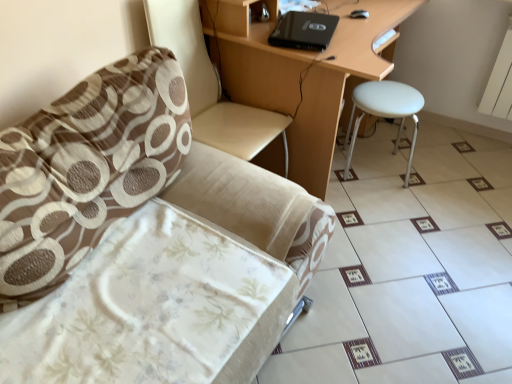
This screenshot has height=384, width=512. I want to click on vacant location behind white matte stool at right, so click(x=381, y=141).